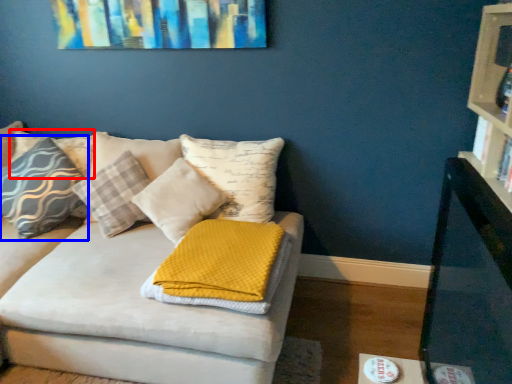
Question: Which object is closer to the camera taking this photo, pillow (highlighted by a red box) or pillow (highlighted by a blue box)?

Choices:
 (A) pillow
 (B) pillow

Answer: (B)